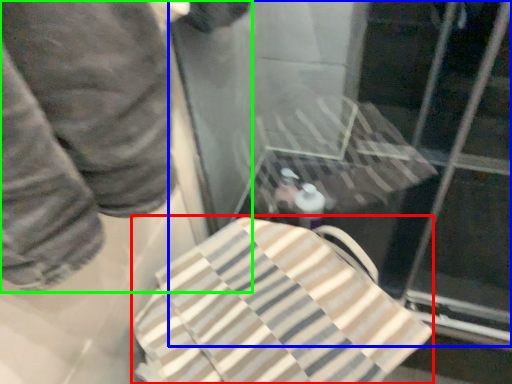
Question: Which object is positioned farthest from beach towel (highlighted by a red box)? Select from glass door (highlighted by a blue box) and person (highlighted by a green box).

Choices:
 (A) glass door
 (B) person

Answer: (A)